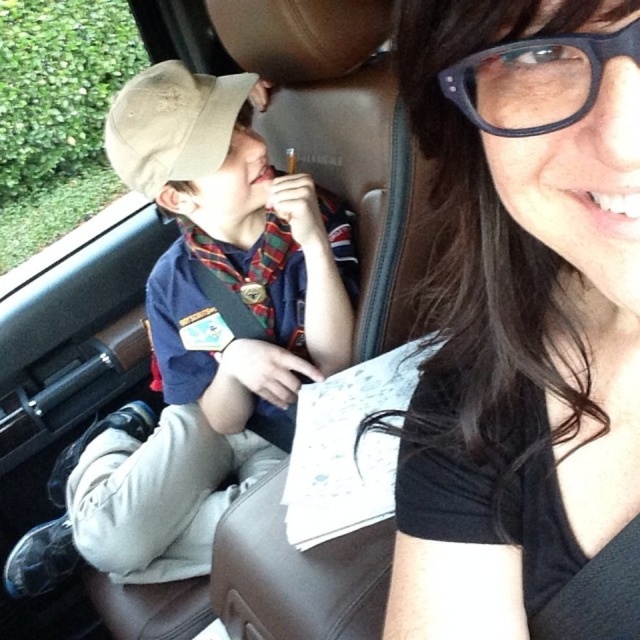
Looking at this image, you are a passenger in the car and want to hand the driver a snack. The snack is currently on the black plastic glasses at upper right. Can you directly hand it to the driver without moving the matte khaki cap at left?

The black plastic glasses at upper right is behind the matte khaki cap at left, so you cannot directly hand the snack to the driver without moving the matte khaki cap at left because the glasses are obstructed by the cap.